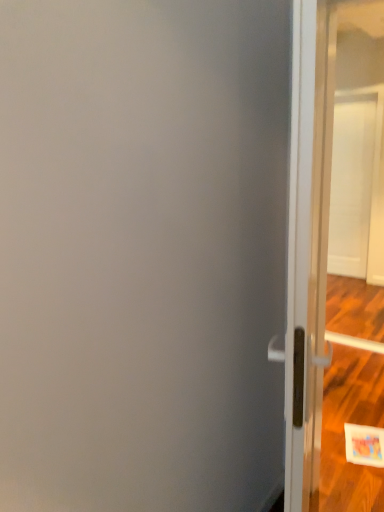
Looking at this image, measure the distance between satin gray door at right and camera.

The distance of satin gray door at right from camera is 4.65 meters.

At what (x,y) coordinates should I click in order to perform the action: click on satin gray door at right. Please return your answer as a coordinate pair (x, y). This screenshot has width=384, height=512. Looking at the image, I should click on (332, 239).

Describe the element at coordinates (332, 239) in the screenshot. I see `satin gray door at right` at that location.

You are a GUI agent. You are given a task and a screenshot of the screen. Output one action in this format:
    pyautogui.click(x=<x>, y=<y>)
    Task: Click on the satin gray door at right
    The image size is (384, 512).
    Given the screenshot: What is the action you would take?
    pyautogui.click(x=332, y=239)